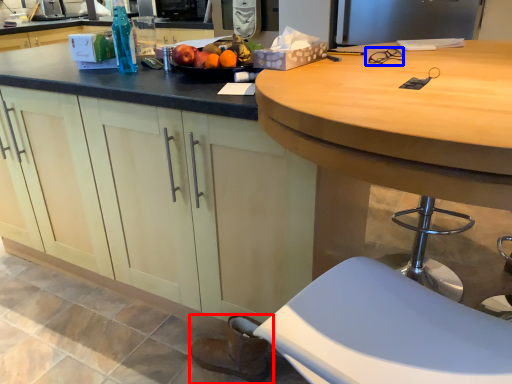
Question: Which point is further to the camera, footwear (highlighted by a red box) or glasses (highlighted by a blue box)?

Choices:
 (A) footwear
 (B) glasses

Answer: (A)